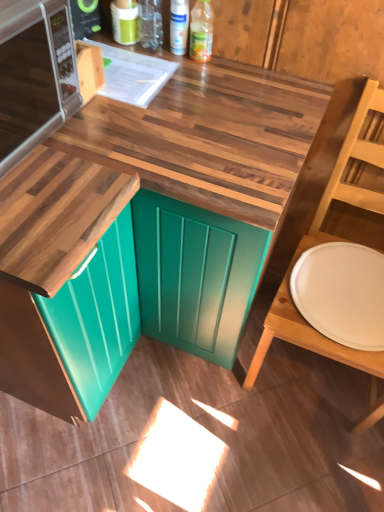
Locate an element on the screen. blank space to the left of white glossy spray can at upper center, which appears as the first bottle when viewed from the left is located at coordinates (115, 50).